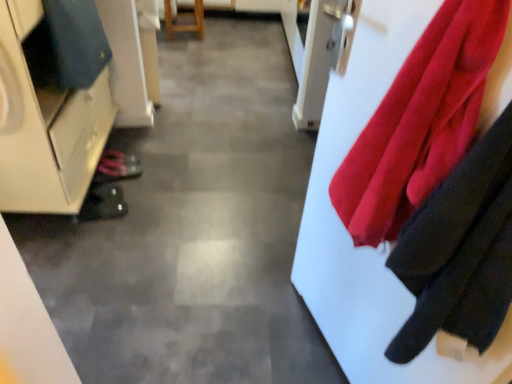
The image size is (512, 384). Describe the element at coordinates (420, 121) in the screenshot. I see `velvety red cloth at right` at that location.

Identify the location of black rubber shoe at lower left, positioned as the 2th shoe in top-to-bottom order. This screenshot has width=512, height=384. (103, 203).

The image size is (512, 384). I want to click on shiny black shoe at lower left, the 2th shoe from the front, so click(117, 167).

Where is `shoe that is the 1st one when counting downward from the wooden stool at center (from the image's perspective)`? shoe that is the 1st one when counting downward from the wooden stool at center (from the image's perspective) is located at coordinates (117, 167).

Is wooden stool at center taller than shiny black shoe at lower left, placed as the 1th shoe when sorted from back to front?

Yes, wooden stool at center is taller than shiny black shoe at lower left, placed as the 1th shoe when sorted from back to front.

Looking at this image, is wooden stool at center aimed at shiny black shoe at lower left, the second shoe from the bottom?

Yes, wooden stool at center is turned towards shiny black shoe at lower left, the second shoe from the bottom.

From a real-world perspective, between wooden stool at center and shiny black shoe at lower left, the 2th shoe from the front, who is vertically lower?

In real-world perspective, shiny black shoe at lower left, the 2th shoe from the front, is lower.

Can you confirm if matte white cabinet at left is wider than black rubber shoe at lower left, the 2th shoe when ordered from back to front?

Indeed, matte white cabinet at left has a greater width compared to black rubber shoe at lower left, the 2th shoe when ordered from back to front.

Is matte white cabinet at left far away from black rubber shoe at lower left, which is the first shoe from front to back?

No.

Which is in front, matte white cabinet at left or black rubber shoe at lower left, which ranks as the first shoe in bottom-to-top order?

matte white cabinet at left is in front.

You are a GUI agent. You are given a task and a screenshot of the screen. Output one action in this format:
    pyautogui.click(x=<x>, y=<y>)
    Task: Click on the cloth that is in front of the wooden stool at center
    
    Given the screenshot: What is the action you would take?
    pyautogui.click(x=420, y=121)

How different are the orientations of wooden stool at center and velvety red cloth at right in degrees?

wooden stool at center and velvety red cloth at right are facing 84.5 degrees away from each other.

Does wooden stool at center touch velvety red cloth at right?

No, wooden stool at center is not beside velvety red cloth at right.

Measure the distance from wooden stool at center to velvety red cloth at right.

wooden stool at center is 2.84 meters from velvety red cloth at right.

Based on the photo, is black rubber shoe at lower left, the 2th shoe when ordered from back to front, inside or outside of wooden stool at center?

black rubber shoe at lower left, the 2th shoe when ordered from back to front, is outside wooden stool at center.

Is black rubber shoe at lower left, the 2th shoe when ordered from back to front, further to the viewer compared to wooden stool at center?

No, the depth of black rubber shoe at lower left, the 2th shoe when ordered from back to front, is less than that of wooden stool at center.

Is black rubber shoe at lower left, which is the first shoe from front to back, positioned with its back to wooden stool at center?

No, black rubber shoe at lower left, which is the first shoe from front to back, is not facing away from wooden stool at center.

How different are the orientations of black rubber shoe at lower left, positioned as the 2th shoe in top-to-bottom order, and wooden stool at center in degrees?

There is a 85.4-degree angle between the facing directions of black rubber shoe at lower left, positioned as the 2th shoe in top-to-bottom order, and wooden stool at center.

Identify the location of cloth located in front of the shiny black shoe at lower left, the second shoe from the bottom. The image size is (512, 384). (420, 121).

Is velvety red cloth at right oriented away from shiny black shoe at lower left, the 2th shoe from the front?

No, velvety red cloth at right's orientation is not away from shiny black shoe at lower left, the 2th shoe from the front.

Consider the image. In the image, is velvety red cloth at right on the left side or the right side of shiny black shoe at lower left, the second shoe from the bottom?

In the image, velvety red cloth at right appears on the right side of shiny black shoe at lower left, the second shoe from the bottom.

From a real-world perspective, between velvety red cloth at right and shiny black shoe at lower left, the 2th shoe from the front, who is vertically lower?

shiny black shoe at lower left, the 2th shoe from the front, from a real-world perspective.

From a real-world perspective, who is located higher, wooden stool at center or matte white cabinet at left?

From a 3D spatial view, matte white cabinet at left is above.

Is point (167, 13) farther from viewer compared to point (23, 187)?

Yes, point (167, 13) is behind point (23, 187).

At what (x,y) coordinates should I click in order to perform the action: click on cabinetry lying below the wooden stool at center (from the image's perspective). Please return your answer as a coordinate pair (x, y). Image resolution: width=512 pixels, height=384 pixels. Looking at the image, I should click on (51, 103).

In terms of size, does wooden stool at center appear bigger or smaller than matte white cabinet at left?

Considering their sizes, wooden stool at center takes up less space than matte white cabinet at left.

Which is more to the right, velvety red cloth at right or black rubber shoe at lower left, the 2th shoe when ordered from back to front?

velvety red cloth at right is more to the right.

From the image's perspective, is velvety red cloth at right below black rubber shoe at lower left, which ranks as the first shoe in bottom-to-top order?

No, from the image's perspective, velvety red cloth at right is not below black rubber shoe at lower left, which ranks as the first shoe in bottom-to-top order.

Which is behind, point (336, 189) or point (116, 191)?

The point (116, 191) is farther.

Are velvety red cloth at right and black rubber shoe at lower left, the 2th shoe when ordered from back to front, located far from each other?

Yes, velvety red cloth at right is far from black rubber shoe at lower left, the 2th shoe when ordered from back to front.

Locate an element on the screen. furniture located above the shiny black shoe at lower left, the 2th shoe from the front (from a real-world perspective) is located at coordinates (185, 25).

Find the location of a particular element. cabinetry above the black rubber shoe at lower left, which is the first shoe from front to back (from the image's perspective) is located at coordinates (51, 103).

Considering their positions, is velvety red cloth at right positioned further to dark blue fabric at left than wooden stool at center?

wooden stool at center is further to dark blue fabric at left.

Estimate the real-world distances between objects in this image. Which object is further from velvety red cloth at right, wooden stool at center or dark blue fabric at left?

Among the two, wooden stool at center is located further to velvety red cloth at right.

From the image, which object appears to be nearer to matte white cabinet at left, black rubber shoe at lower left, the 2th shoe when ordered from back to front, or shiny black shoe at lower left, the second shoe from the bottom?

black rubber shoe at lower left, the 2th shoe when ordered from back to front, is closer to matte white cabinet at left.

Looking at the image, which one is located closer to wooden stool at center, velvety red cloth at right or shiny black shoe at lower left, the 1th shoe positioned from the top?

Among the two, shiny black shoe at lower left, the 1th shoe positioned from the top, is located nearer to wooden stool at center.

Based on their spatial positions, is dark blue fabric at left or shiny black shoe at lower left, the 2th shoe from the front, closer to velvety red cloth at right?

Among the two, dark blue fabric at left is located nearer to velvety red cloth at right.

Estimate the real-world distances between objects in this image. Which object is closer to black rubber shoe at lower left, positioned as the 2th shoe in top-to-bottom order, wooden stool at center or matte white cabinet at left?

matte white cabinet at left is positioned closer to the anchor black rubber shoe at lower left, positioned as the 2th shoe in top-to-bottom order.

Considering their positions, is velvety red cloth at right positioned closer to matte white cabinet at left than wooden stool at center?

velvety red cloth at right lies closer to matte white cabinet at left than the other object.

Which object lies nearer to the anchor point matte white cabinet at left, black rubber shoe at lower left, the 2th shoe when ordered from back to front, or dark blue fabric at left?

Based on the image, dark blue fabric at left appears to be nearer to matte white cabinet at left.

This screenshot has width=512, height=384. Find the location of `shoe located between velvety red cloth at right and shiny black shoe at lower left, placed as the 1th shoe when sorted from back to front, in the depth direction`. shoe located between velvety red cloth at right and shiny black shoe at lower left, placed as the 1th shoe when sorted from back to front, in the depth direction is located at coordinates (103, 203).

Identify the location of cloak positioned between velvety red cloth at right and black rubber shoe at lower left, which is the first shoe from front to back, from near to far. (76, 42).

Identify the location of cloak between velvety red cloth at right and shiny black shoe at lower left, the second shoe from the bottom, in the front-back direction. (76, 42).

This screenshot has width=512, height=384. I want to click on shoe between wooden stool at center and black rubber shoe at lower left, which is the first shoe from front to back, in the up-down direction, so click(x=117, y=167).